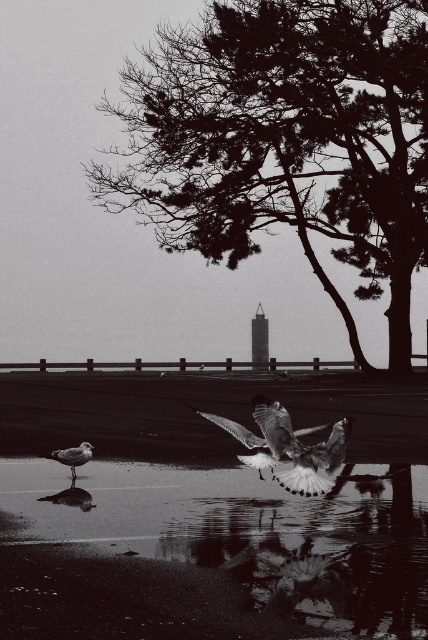
You are a photographer trying to capture the white feathered bird at center and the white feathered bird at lower left in the same frame. Based on their sizes in the image, which bird do you think is closer to the camera?

The white feathered bird at center is closer to the camera because it appears larger than the white feathered bird at lower left.

You are a photographer trying to capture the smooth feathered bird at center and the reflective wet sand at lower center in a single shot. Based on their positions, which object should you focus on first to ensure both are in frame?

The reflective wet sand at lower center is positioned on the left side of smooth feathered bird at center. To ensure both are in frame, focus on the smooth feathered bird at center first as it is centrally located, then adjust to include the reflective wet sand at lower center on its left side.

You are a photographer trying to capture the scene. You want to ensure that the silhouette textured tree at upper center is visible above the white feathered bird at center in your photo. Based on the description, can you confirm if this arrangement is already present in the image?

Yes, the silhouette textured tree at upper center is already positioned above the white feathered bird at center in the image, so the arrangement you desire is already present.